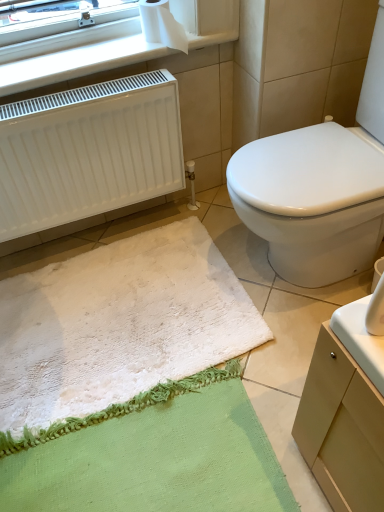
Locate an element on the screen. This screenshot has height=512, width=384. blank space above white plastic radiator at upper left (from a real-world perspective) is located at coordinates (103, 56).